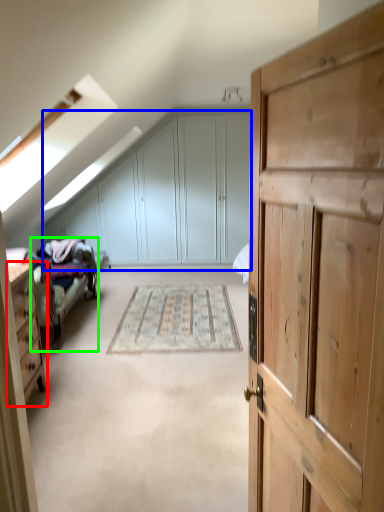
Question: Which object is positioned farthest from chest of drawers (highlighted by a red box)? Select from dresser (highlighted by a blue box) and bed frame (highlighted by a green box).

Choices:
 (A) dresser
 (B) bed frame

Answer: (A)